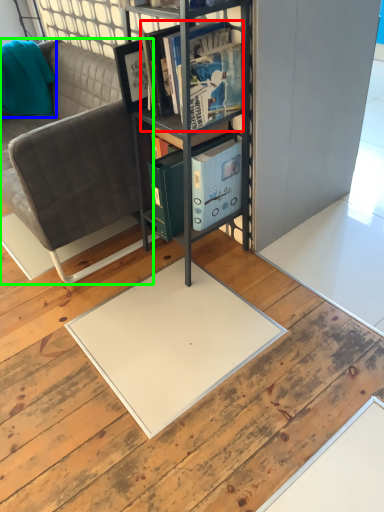
Question: Based on their relative distances, which object is farther from book (highlighted by a red box)? Choose from pillow (highlighted by a blue box) and studio couch (highlighted by a green box).

Choices:
 (A) pillow
 (B) studio couch

Answer: (A)